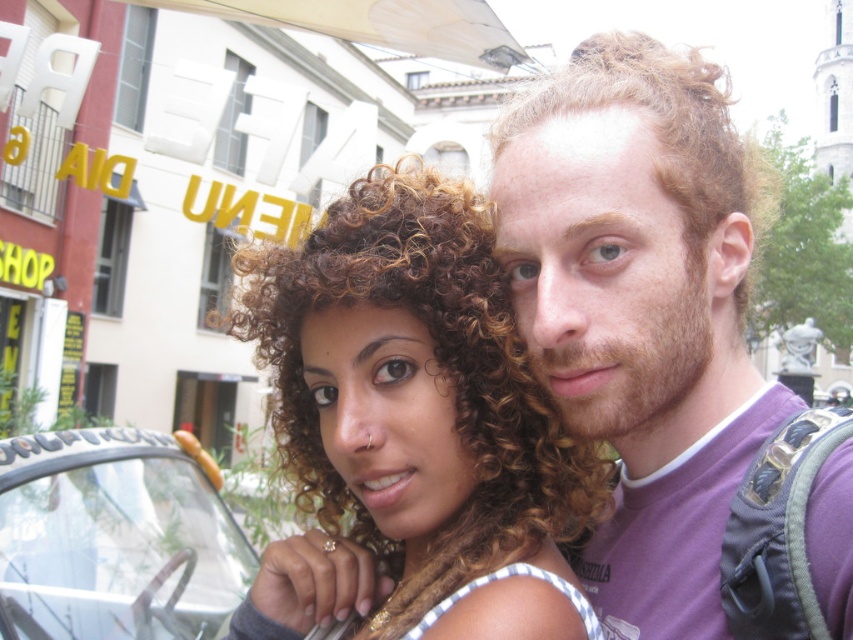
Is curly hair at center to the right of purple cotton t-shirt at upper right from the viewer's perspective?

No, curly hair at center is not to the right of purple cotton t-shirt at upper right.

Which is behind, point (425, 364) or point (700, 355)?

Point (700, 355)

I want to click on curly hair at center, so click(x=413, y=426).

How distant is curly hair at center from blonde curly hair at upper right?

curly hair at center is 15.68 meters from blonde curly hair at upper right.

Does curly hair at center lie behind blonde curly hair at upper right?

No.

The image size is (853, 640). In order to click on curly hair at center in this screenshot , I will do `click(413, 426)`.

Can you confirm if purple cotton t-shirt at upper right is positioned below transparent plastic car at lower left?

Incorrect, purple cotton t-shirt at upper right is not positioned below transparent plastic car at lower left.

This screenshot has width=853, height=640. Find the location of `purple cotton t-shirt at upper right`. purple cotton t-shirt at upper right is located at coordinates (641, 308).

The height and width of the screenshot is (640, 853). Find the location of `purple cotton t-shirt at upper right`. purple cotton t-shirt at upper right is located at coordinates (641, 308).